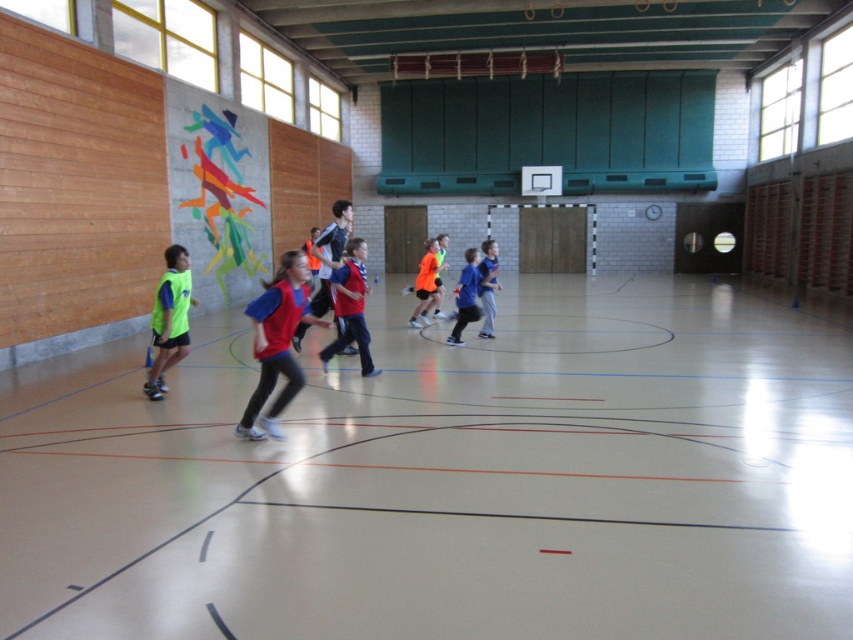
You are a referee in the sports hall and need to determine if the two blue items are within a 3 meter safety zone for a game setup. Are the matte blue jacket at center and the blue fabric shirt at center within 3 meters of each other?

The distance between the matte blue jacket at center and the blue fabric shirt at center is 2.72 meters, which is within the 3 meter safety zone, so yes they are within the required distance.

You are standing in the sports hall and want to take a photo of both point [436,260] and point [439,264]. Which point should you focus on first to ensure both are in clear view?

You should focus on point [436,260] first because it is closer to the camera than point [439,264], ensuring both points are in clear view.

Looking at this image, you are standing in the sports hall and see the children playing. There is a point marked at coordinates (x=329, y=253). What object is located at that point?

The point at coordinates (x=329, y=253) marks the location of the matte blue jacket at center.